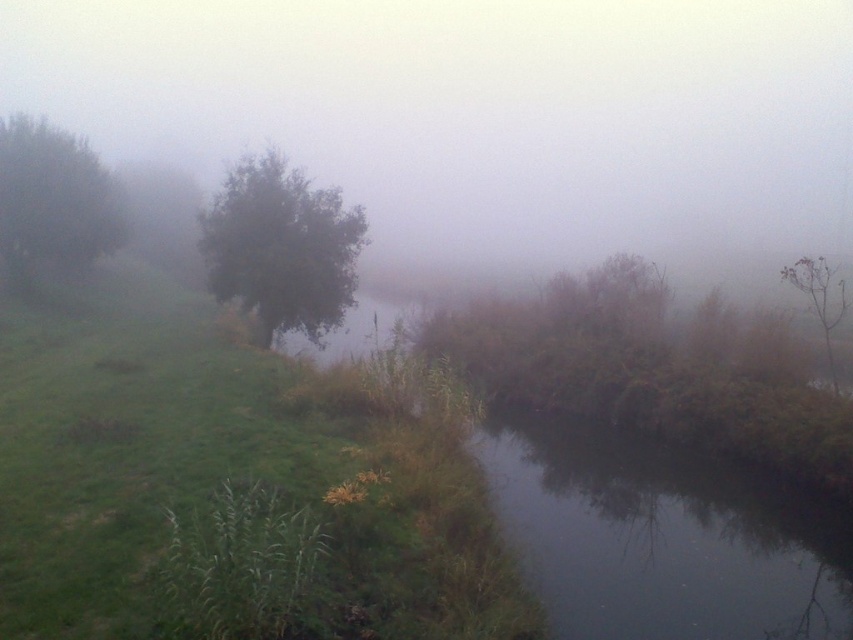
What are the coordinates of `green leafy tree at center` in the screenshot? It's located at (281, 248).

Is green leafy tree at center to the right of brown matte tree at upper right from the viewer's perspective?

No, green leafy tree at center is not to the right of brown matte tree at upper right.

Does point (292, 202) come closer to viewer compared to point (830, 288)?

No.

Locate an element on the screen. Image resolution: width=853 pixels, height=640 pixels. green leafy tree at center is located at coordinates (281, 248).

Who is more distant from viewer, (299, 320) or (30, 237)?

The point (30, 237) is more distant.

Which is below, green leafy tree at center or green matte tree at left?

Positioned lower is green leafy tree at center.

Which is behind, point (358, 225) or point (6, 230)?

The point (6, 230) is behind.

Locate an element on the screen. green leafy tree at center is located at coordinates (281, 248).

Can you confirm if green matte tree at left is positioned to the right of brown matte tree at upper right?

No, green matte tree at left is not to the right of brown matte tree at upper right.

Can you confirm if green matte tree at left is smaller than brown matte tree at upper right?

Indeed, green matte tree at left has a smaller size compared to brown matte tree at upper right.

Which is in front, point (111, 243) or point (814, 310)?

Positioned in front is point (814, 310).

Where is `green matte tree at left`? This screenshot has height=640, width=853. green matte tree at left is located at coordinates (53, 202).